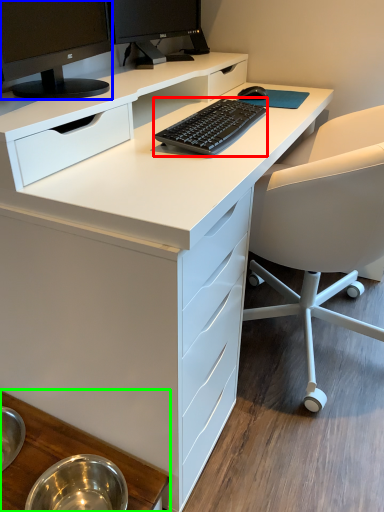
Question: Which object is the farthest from computer keyboard (highlighted by a red box)? Choose among these: computer monitor (highlighted by a blue box) or table (highlighted by a green box).

Choices:
 (A) computer monitor
 (B) table

Answer: (B)